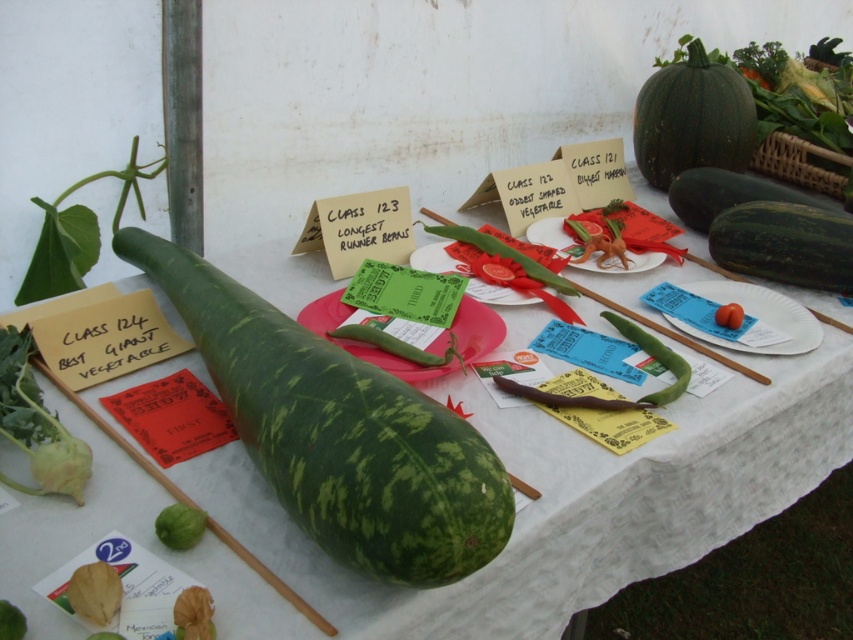
Which of these two, green spotted gourd at center or matte green plate at center, stands taller?

With more height is green spotted gourd at center.

Can you confirm if green spotted gourd at center is positioned to the right of matte green plate at center?

Incorrect, green spotted gourd at center is not on the right side of matte green plate at center.

The image size is (853, 640). Find the location of `green spotted gourd at center`. green spotted gourd at center is located at coordinates 338,433.

This screenshot has height=640, width=853. I want to click on green spotted gourd at center, so click(x=338, y=433).

Which is more to the left, smooth red tomato at center or green matte squash at center?

From the viewer's perspective, green matte squash at center appears more on the left side.

Between point (780, 296) and point (175, 524), which one is positioned behind?

Point (780, 296)

Which is in front, point (712, 296) or point (165, 516)?

Positioned in front is point (165, 516).

The image size is (853, 640). Identify the location of smooth red tomato at center. (757, 316).

Between green matte cucumber at center and smooth red tomato at center, which one appears on the right side from the viewer's perspective?

green matte cucumber at center is more to the right.

I want to click on green matte cucumber at center, so click(784, 244).